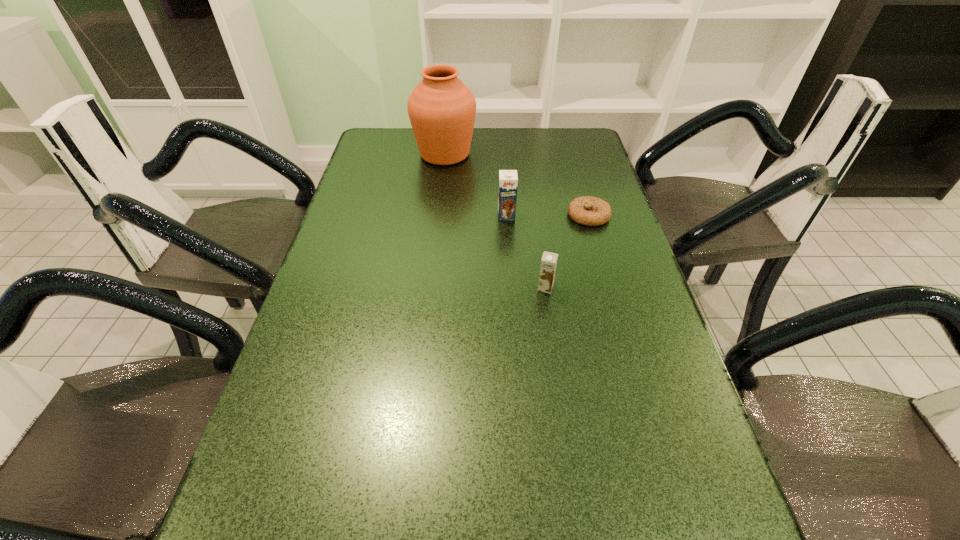
Locate an element on the screen. free space located 0.160m on the right of the shorter chocolate milk is located at coordinates pos(621,287).

The image size is (960, 540). Find the location of `free space located 0.050m on the back of the bagel`. free space located 0.050m on the back of the bagel is located at coordinates (583, 194).

Locate an element on the screen. object located at the far edge is located at coordinates (442, 110).

Find the location of a particular element. The width and height of the screenshot is (960, 540). object at the right edge is located at coordinates (599, 211).

Where is `vacant space at the far edge of the desktop`? The height and width of the screenshot is (540, 960). vacant space at the far edge of the desktop is located at coordinates (481, 160).

You are a GUI agent. You are given a task and a screenshot of the screen. Output one action in this format:
    pyautogui.click(x=<x>, y=<y>)
    Task: Click on the free space at the left edge of the desktop
    
    Given the screenshot: What is the action you would take?
    [327, 380]

You are a GUI agent. You are given a task and a screenshot of the screen. Output one action in this format:
    pyautogui.click(x=<x>, y=<y>)
    Task: Click on the vacant space at the right edge of the desktop
    
    Given the screenshot: What is the action you would take?
    pyautogui.click(x=596, y=166)

In the image, there is a desktop. Where is `blank space at the far left corner`? This screenshot has height=540, width=960. blank space at the far left corner is located at coordinates (382, 143).

You are a GUI agent. You are given a task and a screenshot of the screen. Output one action in this format:
    pyautogui.click(x=<x>, y=<y>)
    Task: Click on the free spot between the tallest object and the second object from right to left
    
    Given the screenshot: What is the action you would take?
    pyautogui.click(x=495, y=221)

In order to click on vacant space that's between the taller chocolate milk and the bagel in this screenshot , I will do tap(547, 215).